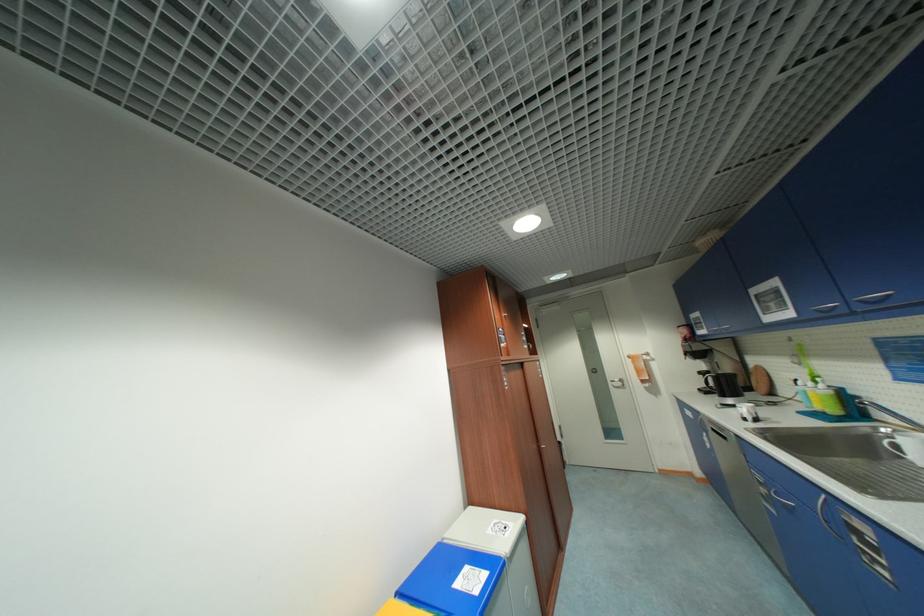
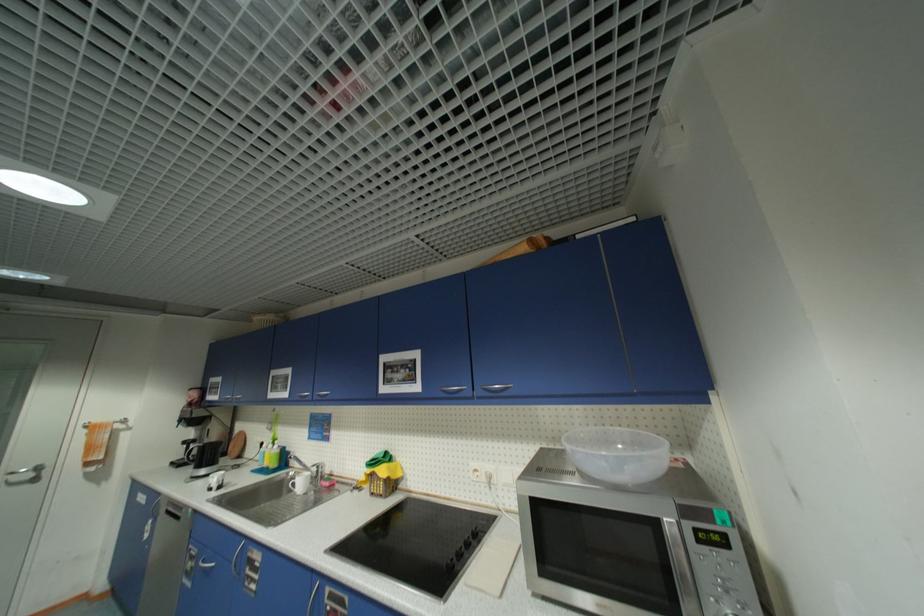
The point at (615, 384) is marked in the first image. Where is the corresponding point in the second image?

(7, 479)